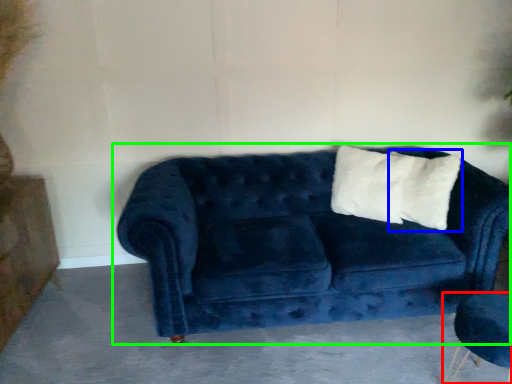
Question: Based on their relative distances, which object is nearer to armchair (highlighted by a red box)? Choose from pillow (highlighted by a blue box) and studio couch (highlighted by a green box).

Choices:
 (A) pillow
 (B) studio couch

Answer: (A)